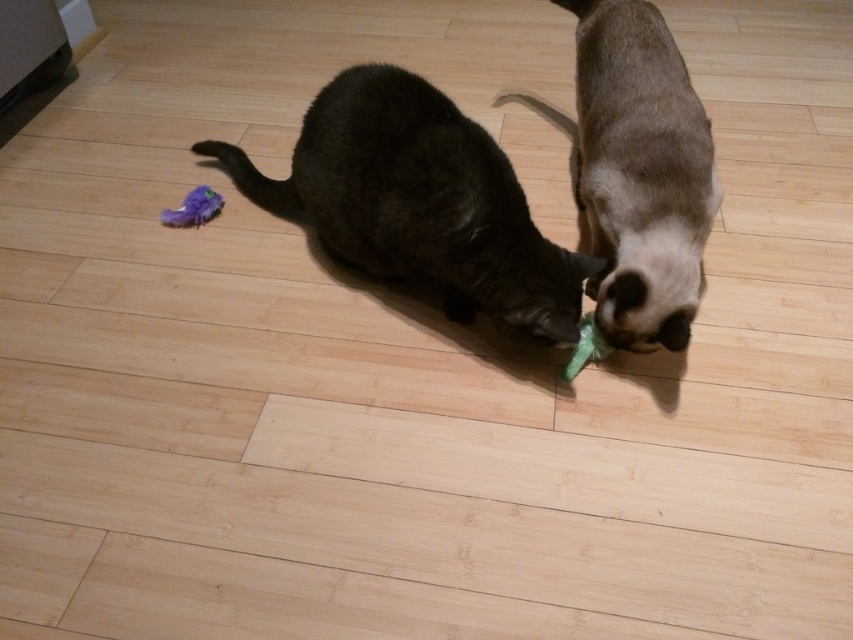
Question: Which of the following is the farthest from the observer?

Choices:
 (A) satin fur cat at center
 (B) dark brown fur cat at center

Answer: (B)

Question: Which point is closer to the camera taking this photo?

Choices:
 (A) (630, 289)
 (B) (373, 120)

Answer: (A)

Question: Considering the relative positions of dark brown fur cat at center and satin fur cat at center in the image provided, where is dark brown fur cat at center located with respect to satin fur cat at center?

Choices:
 (A) above
 (B) below

Answer: (B)

Question: Does dark brown fur cat at center have a smaller size compared to satin fur cat at center?

Choices:
 (A) yes
 (B) no

Answer: (B)

Question: Does dark brown fur cat at center appear on the left side of satin fur cat at center?

Choices:
 (A) yes
 (B) no

Answer: (A)